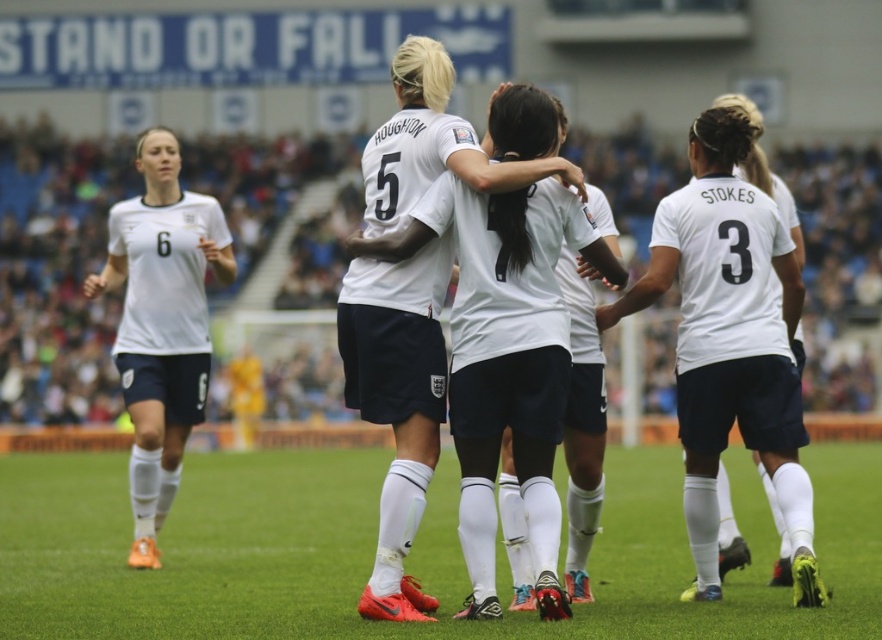
The width and height of the screenshot is (882, 640). I want to click on white matte jersey at center, so click(513, 365).

Which is below, white matte jersey at center or white matte jersey at left?

white matte jersey at center is below.

Find the location of a particular element. The image size is (882, 640). white matte jersey at center is located at coordinates (513, 365).

Measure the distance from white synthetic turf at center to white matte jersey at center.

white synthetic turf at center and white matte jersey at center are 19.54 feet apart from each other.

Based on the photo, can you confirm if white synthetic turf at center is thinner than white matte jersey at center?

No.

Does point (355, 468) come closer to viewer compared to point (537, 493)?

No, it is behind (537, 493).

Identify the location of white synthetic turf at center. Image resolution: width=882 pixels, height=640 pixels. (406, 556).

Can you confirm if white synthetic turf at center is wider than white matte jersey at left?

Yes, white synthetic turf at center is wider than white matte jersey at left.

Can you confirm if white synthetic turf at center is positioned above white matte jersey at left?

No.

Who is more distant from viewer, (622, 470) or (187, 342)?

The point (622, 470) is behind.

The height and width of the screenshot is (640, 882). I want to click on white synthetic turf at center, so click(406, 556).